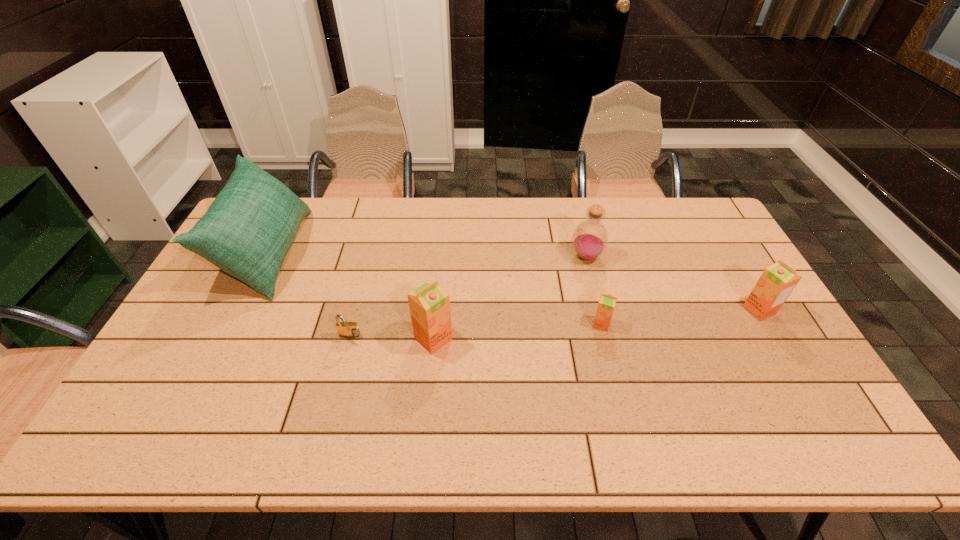
The orange juices are evenly distributed in the image. To maintain this, where would you place another orange juice on the left? Please point to a free space. Please provide its 2D coordinates. Your answer should be formatted as a tuple, i.e. [(x, y)], where the tuple contains the x and y coordinates of a point satisfying the conditions above.

[(255, 355)]